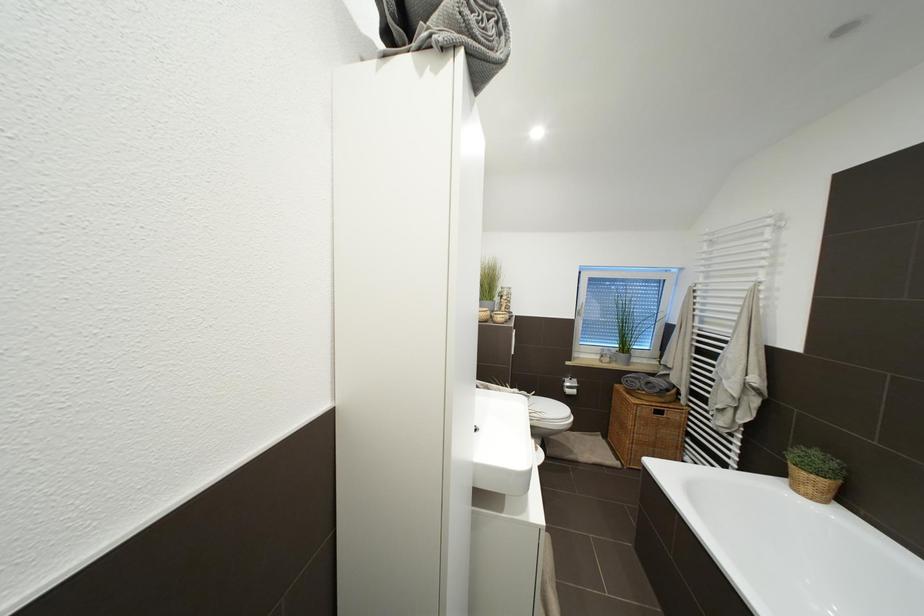
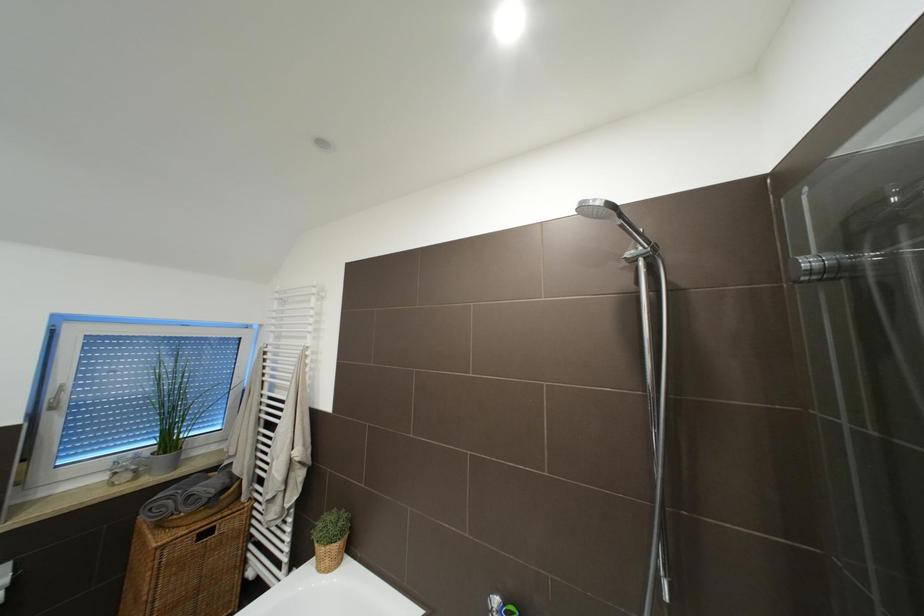
Question: The first image is from the beginning of the video and the second image is from the end. How did the camera likely rotate when shooting the video?

Choices:
 (A) Left
 (B) Right
 (C) Up
 (D) Down

Answer: (B)